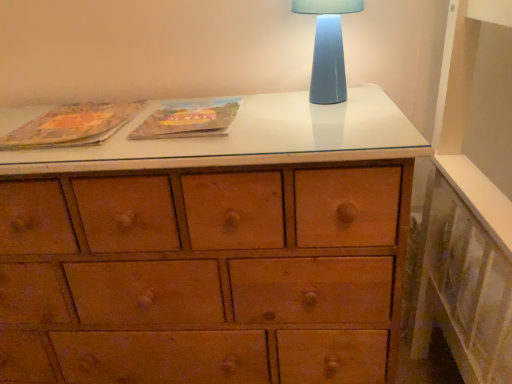
Question: In terms of height, does blue ceramic table lamp at upper right look taller or shorter compared to matte cardboard book at center, marked as the second paperback book in a left-to-right arrangement?

Choices:
 (A) tall
 (B) short

Answer: (A)

Question: In terms of width, does blue ceramic table lamp at upper right look wider or thinner when compared to matte cardboard book at center, marked as the second paperback book in a left-to-right arrangement?

Choices:
 (A) thin
 (B) wide

Answer: (A)

Question: Estimate the real-world distances between objects in this image. Which object is closer to the matte paper book at upper left, marked as the first paperback book in a left-to-right arrangement?

Choices:
 (A) blue ceramic table lamp at upper right
 (B) matte cardboard book at center, marked as the first paperback book in a right-to-left arrangement

Answer: (B)

Question: Estimate the real-world distances between objects in this image. Which object is farther from the matte cardboard book at center, marked as the first paperback book in a right-to-left arrangement?

Choices:
 (A) matte paper book at upper left, placed as the second paperback book when sorted from right to left
 (B) blue ceramic table lamp at upper right

Answer: (B)